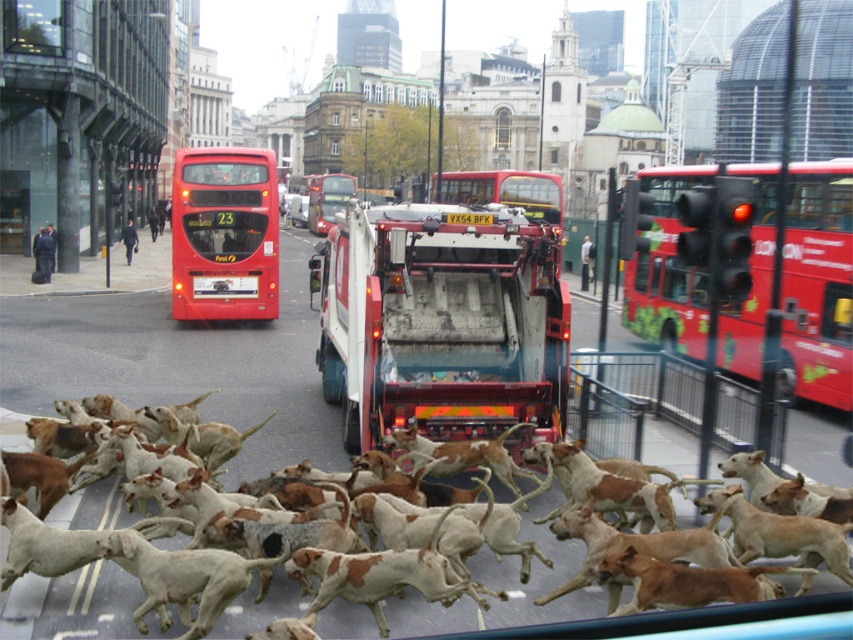
You are a pedestrian standing at the crosswalk. The red matte bus at upper right is approaching. If you can run 5 meters per second, how many seconds do you have before the bus reaches you?

The distance between you and the red matte bus at upper right is 7.16 meters. At a running speed of 5 meters per second, you have approximately 1.43 seconds before the bus reaches you.

You are a pedestrian standing at the crosswalk. The crosswalk is 2 meters in front of you. There is a matte red bus at center. Can you safely cross the street without getting too close to the bus?

The matte red bus at center is 18.51 meters from the camera. Since the crosswalk is only 2 meters in front of you, there is sufficient distance between you and the bus, so you can safely cross the street without getting too close to the matte red bus at center.

You are a delivery person who needs to deliver a package to the address on the white plastic license plate at center. The red matte bus at center is blocking the path. Can you estimate if the bus is too wide to move out of the way quickly?

The red matte bus at center might be wider than white plastic license plate at center, so it might be difficult to move out of the way quickly if the bus is wider than the license plate.